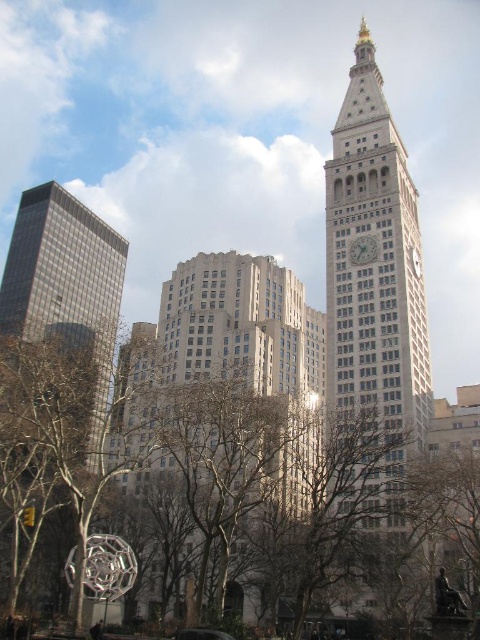
You are standing in the city park and see the brown leafless tree at lower left and the glassy reflective skyscraper at left. Which object is positioned more to the east if the sun is setting in the west?

The glassy reflective skyscraper at left is positioned more to the east because the brown leafless tree at lower left is to its right, implying the skyscraper is eastward.

What is located at the point with coordinates (375, 273) in the image?

The gold plated stone clock tower at center is located at point (375, 273).